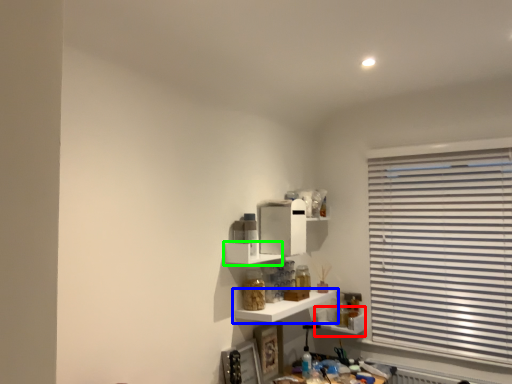
Question: Considering the real-world distances, which object is farthest from shelf (highlighted by a red box)? shelf (highlighted by a blue box) or shelf (highlighted by a green box)?

Choices:
 (A) shelf
 (B) shelf

Answer: (B)